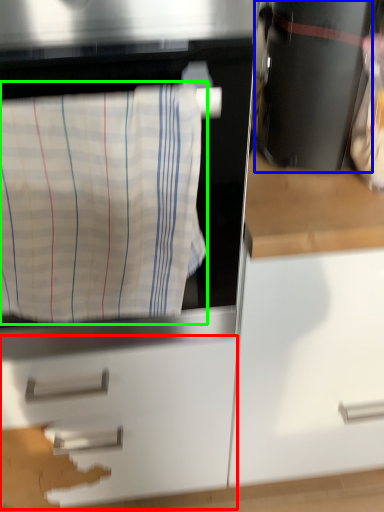
Question: Based on their relative distances, which object is farther from drawer (highlighted by a red box)? Choose from appliance (highlighted by a blue box) and laundry (highlighted by a green box).

Choices:
 (A) appliance
 (B) laundry

Answer: (A)